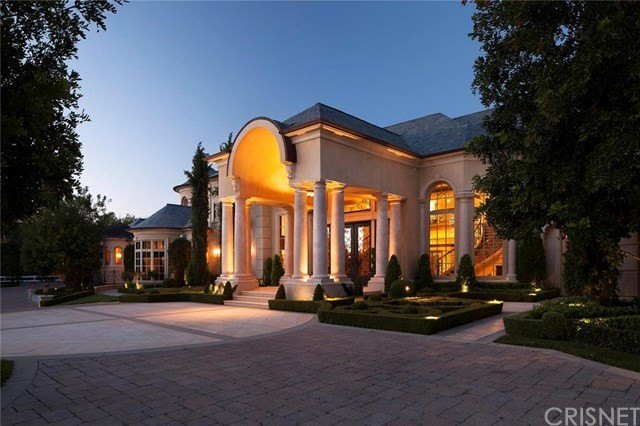
Locate an element on the screen. The width and height of the screenshot is (640, 426). column is located at coordinates (226, 238), (239, 243), (299, 242), (288, 243), (316, 246), (340, 238), (381, 233), (395, 230), (463, 230), (509, 256).